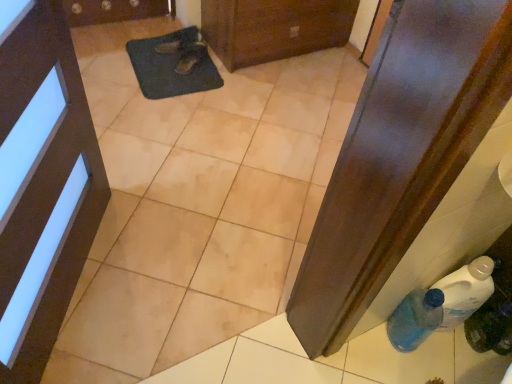
Locate an element on the screen. The width and height of the screenshot is (512, 384). unoccupied space behind matte black door at upper left, positioned as the second door in right-to-left order is located at coordinates (163, 197).